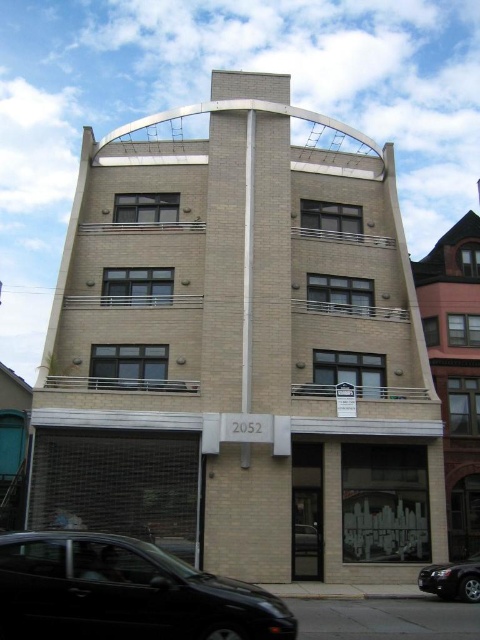
You are a delivery person trying to park a delivery van that is 2 meters wide. You see the shiny black car at lower left and the black glossy sedan at lower right parked in the parking area. Can you determine if there is enough space between them to park your van?

The shiny black car at lower left might be wider than black glossy sedan at lower right, so the space between them may not be wide enough for a 2 meter wide van. Check the actual width before attempting to park.